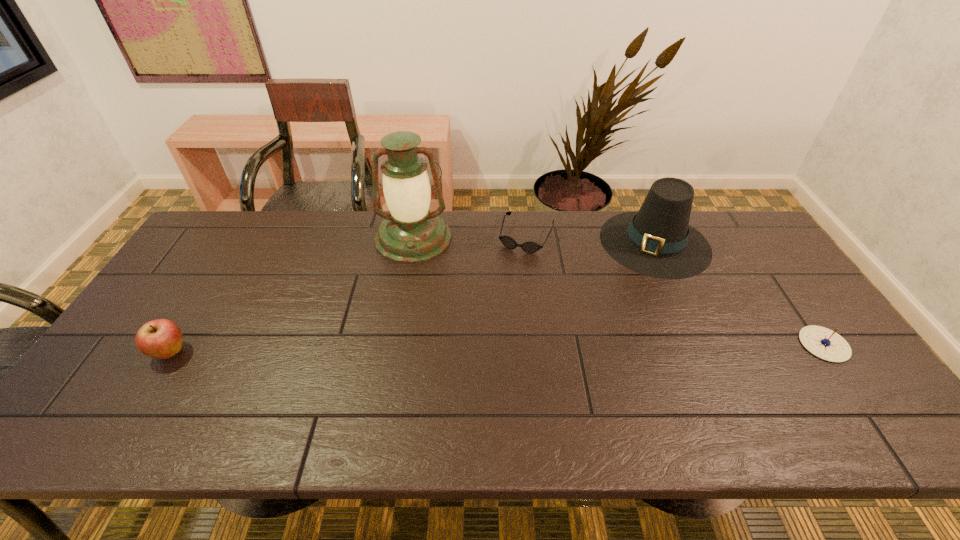
In order to click on vacant space located 0.250m on the front-facing side of the fourth object from left to right in this screenshot , I will do click(x=596, y=322).

Where is `lantern that is at the far edge`? lantern that is at the far edge is located at coordinates (411, 233).

Where is `sunglasses located at the far edge`? sunglasses located at the far edge is located at coordinates (530, 246).

This screenshot has width=960, height=540. In order to click on hat located in the far edge section of the desktop in this screenshot , I will do `click(657, 241)`.

Where is `object that is positioned at the left edge`? object that is positioned at the left edge is located at coordinates (162, 338).

Locate an element on the screen. object located in the right edge section of the desktop is located at coordinates (822, 342).

In the image, there is a desktop. Where is `blank space at the far edge`? This screenshot has width=960, height=540. blank space at the far edge is located at coordinates (588, 250).

Image resolution: width=960 pixels, height=540 pixels. In order to click on vacant space at the near edge of the desktop in this screenshot , I will do `click(571, 388)`.

Find the location of a particular element. The width and height of the screenshot is (960, 540). free spot at the left edge of the desktop is located at coordinates (147, 367).

Find the location of a particular element. vacant area at the far right corner of the desktop is located at coordinates (743, 234).